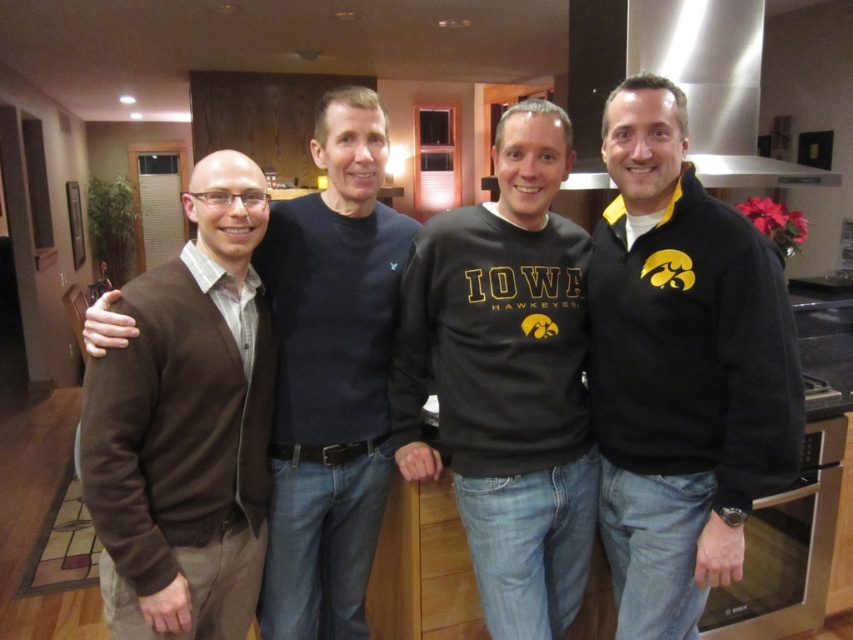
Who is higher up, black matte sweatshirt at center or brown sweater at left?

black matte sweatshirt at center is above.

Does black matte sweatshirt at center have a lesser height compared to brown sweater at left?

Indeed, black matte sweatshirt at center has a lesser height compared to brown sweater at left.

Consider the image. Who is more distant from viewer, (503, 545) or (350, 300)?

Positioned behind is point (350, 300).

You are a GUI agent. You are given a task and a screenshot of the screen. Output one action in this format:
    pyautogui.click(x=<x>, y=<y>)
    Task: Click on the black matte sweatshirt at center
    The image size is (853, 640).
    Given the screenshot: What is the action you would take?
    pyautogui.click(x=506, y=378)

Which is below, black matte sweatshirt at center or stainless steel exhaust hood at upper right?

black matte sweatshirt at center is below.

Which is more to the right, black matte sweatshirt at center or stainless steel exhaust hood at upper right?

stainless steel exhaust hood at upper right is more to the right.

Between point (579, 474) and point (701, 26), which one is positioned behind?

Positioned behind is point (701, 26).

Find the location of a particular element. Image resolution: width=853 pixels, height=640 pixels. black matte sweatshirt at center is located at coordinates (506, 378).

Is brown cardigan at left below stainless steel exhaust hood at upper right?

Yes.

Which of these two, brown cardigan at left or stainless steel exhaust hood at upper right, stands shorter?

stainless steel exhaust hood at upper right

What do you see at coordinates (189, 424) in the screenshot? This screenshot has height=640, width=853. I see `brown cardigan at left` at bounding box center [189, 424].

Identify the location of brown cardigan at left. (189, 424).